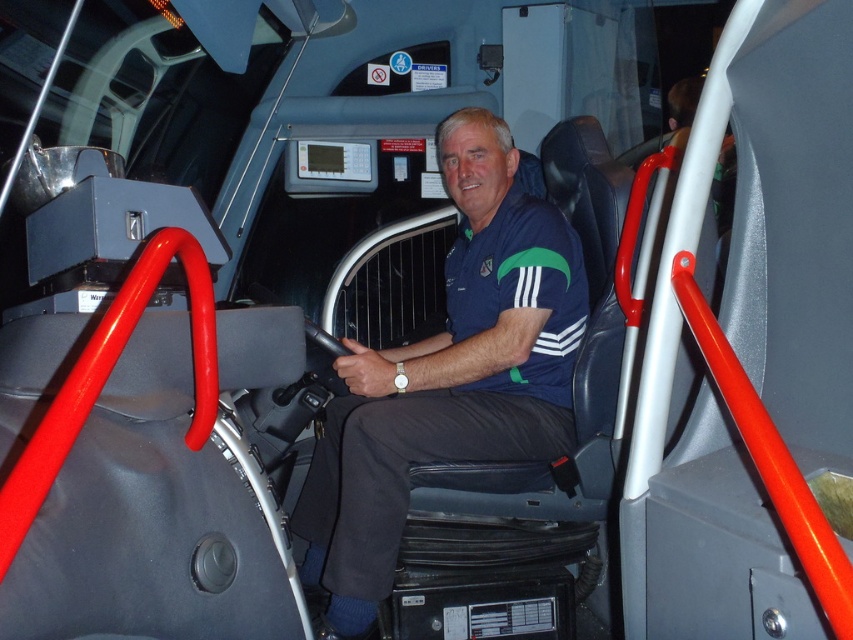
This screenshot has width=853, height=640. What do you see at coordinates (447, 376) in the screenshot? I see `blue fabric shirt at center` at bounding box center [447, 376].

Does point (363, 397) come closer to viewer compared to point (498, 220)?

No, (363, 397) is behind (498, 220).

Image resolution: width=853 pixels, height=640 pixels. Describe the element at coordinates (447, 376) in the screenshot. I see `blue fabric shirt at center` at that location.

What are the coordinates of `blue fabric shirt at center` in the screenshot? It's located at (447, 376).